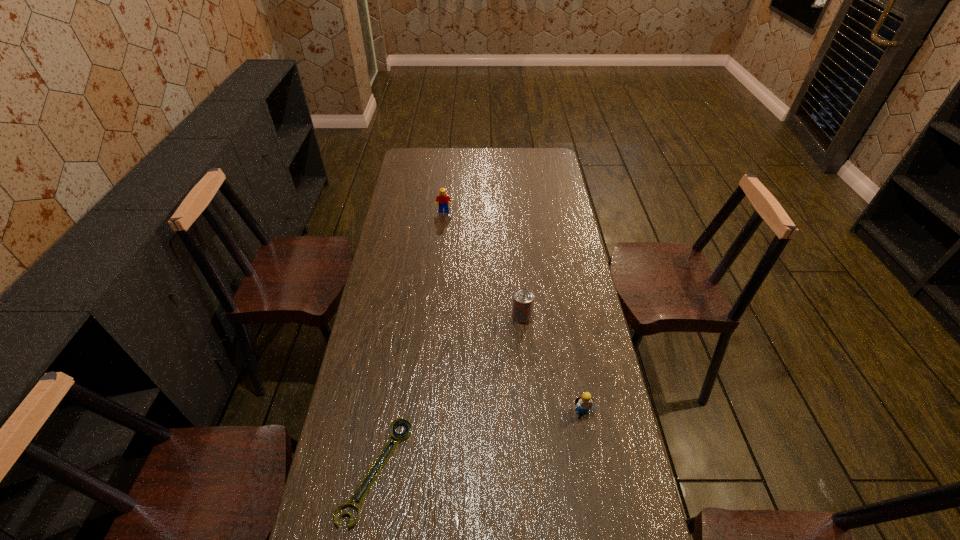
You are a GUI agent. You are given a task and a screenshot of the screen. Output one action in this format:
    pyautogui.click(x=<x>, y=<y>)
    Task: Click on the taller Lego
    The width and height of the screenshot is (960, 540).
    Given the screenshot: What is the action you would take?
    pyautogui.click(x=442, y=199)

The width and height of the screenshot is (960, 540). Identify the location of the left Lego. (442, 199).

The image size is (960, 540). What are the coordinates of `the third object from left to right` in the screenshot? It's located at tap(523, 299).

Locate an element on the screen. Image resolution: width=960 pixels, height=540 pixels. the second farthest object is located at coordinates (523, 299).

Locate an element on the screen. The width and height of the screenshot is (960, 540). the right Lego is located at coordinates (584, 401).

You are a GUI agent. You are given a task and a screenshot of the screen. Output one action in this format:
    pyautogui.click(x=<x>, y=<y>)
    Task: Click on the second nearest object
    The image size is (960, 540).
    Given the screenshot: What is the action you would take?
    pyautogui.click(x=584, y=401)

The width and height of the screenshot is (960, 540). What are the coordinates of `wrench` in the screenshot? It's located at (401, 421).

The image size is (960, 540). Identify the location of the shortest object. (401, 421).

Where is `free location located on the front-facing side of the taller Lego`? This screenshot has height=540, width=960. free location located on the front-facing side of the taller Lego is located at coordinates (440, 261).

You are a GUI agent. You are given a task and a screenshot of the screen. Output one action in this format:
    pyautogui.click(x=<x>, y=<y>)
    Task: Click on the free location located 0.170m on the right of the beer can
    Image resolution: width=960 pixels, height=540 pixels.
    Given the screenshot: What is the action you would take?
    pyautogui.click(x=581, y=316)